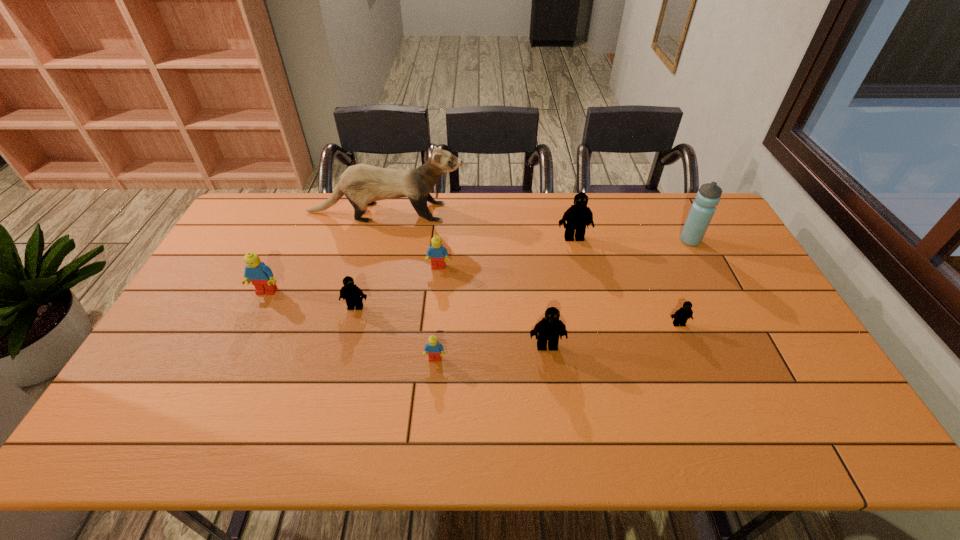
This screenshot has height=540, width=960. I want to click on free space at the left edge of the desktop, so click(215, 346).

This screenshot has height=540, width=960. In the image, there is a desktop. In order to click on vacant space at the right edge in this screenshot , I will do `click(732, 328)`.

You are a GUI agent. You are given a task and a screenshot of the screen. Output one action in this format:
    pyautogui.click(x=<x>, y=<y>)
    Task: Click on the free space between the second Lego from left to right and the nearest Lego
    The height and width of the screenshot is (540, 960).
    Given the screenshot: What is the action you would take?
    pyautogui.click(x=396, y=333)

I want to click on vacant area between the second Lego from left to right and the gray ferret, so click(371, 260).

Locate an element on the screen. free space between the smallest black Lego and the sixth nearest object is located at coordinates (559, 295).

Locate an element on the screen. empty location between the water bottle and the gray ferret is located at coordinates (538, 226).

The height and width of the screenshot is (540, 960). Find the location of `vacant space that is in between the nearest object and the second nearest object`. vacant space that is in between the nearest object and the second nearest object is located at coordinates (491, 353).

Identify the location of free space between the water bottle and the second smallest blue Lego. (564, 254).

Where is `free spot between the farthest object and the biggest blue Lego`? free spot between the farthest object and the biggest blue Lego is located at coordinates (326, 252).

In order to click on empty space that is in between the eighth object from left to right and the fourth nearest object in this screenshot , I will do `click(517, 315)`.